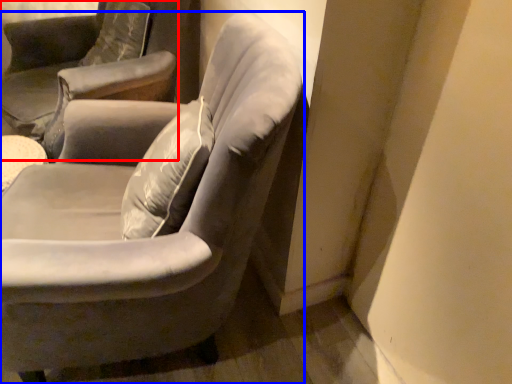
Question: Which of the following is the closest to the observer, chair (highlighted by a red box) or chair (highlighted by a blue box)?

Choices:
 (A) chair
 (B) chair

Answer: (B)